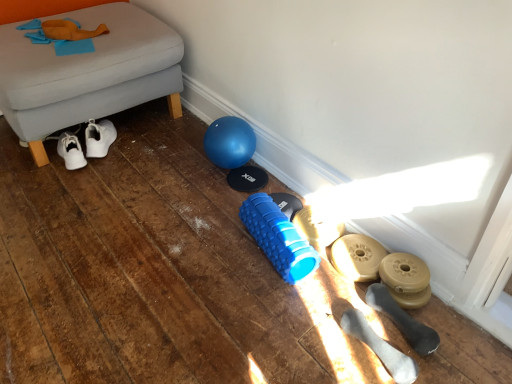
Question: From a real-world perspective, is white rubber dumbbells at lower right, which is the 5th footwear from back to front, positioned above or below blue rubber foam roller at center?

Choices:
 (A) below
 (B) above

Answer: (A)

Question: Considering their positions, is white rubber dumbbells at lower right, the 1th footwear in the front-to-back sequence, located in front of or behind blue rubber foam roller at center?

Choices:
 (A) behind
 (B) front

Answer: (B)

Question: Which of these objects is positioned closest to the matte gold dumbbell at lower right, which appears as the third footwear when viewed from the back?

Choices:
 (A) beige rubber weight at lower right, the 2th footwear in the back-to-front sequence
 (B) black rubber dumbbell at lower right, which is counted as the 4th footwear, starting from the back
 (C) blue rubber foam roller at center
 (D) gray fabric ottoman at lower left
 (E) white rubber dumbbells at lower right, the 1th footwear in the front-to-back sequence

Answer: (B)

Question: Which object is positioned closest to the matte gold dumbbell at lower right, positioned as the third footwear in front-to-back order?

Choices:
 (A) black rubber dumbbell at lower right, which is the second footwear in front-to-back order
 (B) beige rubber weight at lower right, which is the fourth footwear from front to back
 (C) white rubber dumbbells at lower right, which is the 5th footwear from back to front
 (D) gray fabric ottoman at lower left
 (E) blue rubber foam roller at center

Answer: (A)